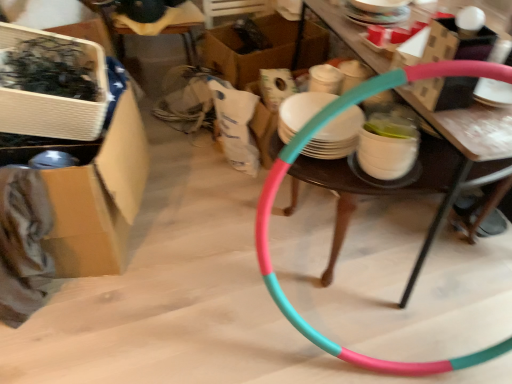
Question: Can you confirm if white cardboard box at upper left, which is the third box in back-to-front order, is shorter than wooden chair at upper center?

Choices:
 (A) yes
 (B) no

Answer: (A)

Question: Is white cardboard box at upper left, which is the third box in back-to-front order, facing towards wooden chair at upper center?

Choices:
 (A) no
 (B) yes

Answer: (A)

Question: Can you confirm if white cardboard box at upper left, which is the third box in back-to-front order, is taller than wooden chair at upper center?

Choices:
 (A) no
 (B) yes

Answer: (A)

Question: Can you confirm if white cardboard box at upper left, which is the third box in back-to-front order, is smaller than wooden chair at upper center?

Choices:
 (A) yes
 (B) no

Answer: (A)

Question: Is white cardboard box at upper left, marked as the 1th box in a front-to-back arrangement, positioned with its back to wooden chair at upper center?

Choices:
 (A) yes
 (B) no

Answer: (A)

Question: Is white cardboard box at upper left, marked as the 1th box in a front-to-back arrangement, to the left of wooden chair at upper center from the viewer's perspective?

Choices:
 (A) no
 (B) yes

Answer: (B)

Question: Is pink rubber hula hoop at center inside wooden chair at upper center?

Choices:
 (A) yes
 (B) no

Answer: (B)

Question: Is wooden chair at upper center positioned with its back to pink rubber hula hoop at center?

Choices:
 (A) yes
 (B) no

Answer: (B)

Question: From a real-world perspective, does wooden chair at upper center sit lower than pink rubber hula hoop at center?

Choices:
 (A) no
 (B) yes

Answer: (A)

Question: Considering the relative sizes of wooden chair at upper center and pink rubber hula hoop at center in the image provided, is wooden chair at upper center wider than pink rubber hula hoop at center?

Choices:
 (A) no
 (B) yes

Answer: (A)

Question: Is wooden chair at upper center at the right side of pink rubber hula hoop at center?

Choices:
 (A) no
 (B) yes

Answer: (A)

Question: Could you tell me if wooden chair at upper center is facing pink rubber hula hoop at center?

Choices:
 (A) no
 (B) yes

Answer: (A)

Question: From the image's perspective, is white cardboard box at upper left, which is the third box in back-to-front order, located beneath pink rubber hula hoop at center?

Choices:
 (A) no
 (B) yes

Answer: (A)